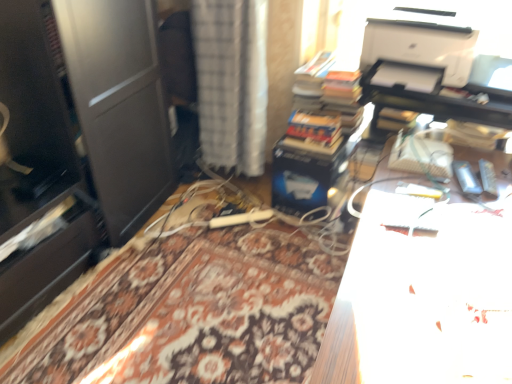
Question: From the image's perspective, is white matte printer at upper right under hardcover books at center?

Choices:
 (A) no
 (B) yes

Answer: (A)

Question: Is white matte printer at upper right to the right of hardcover books at center from the viewer's perspective?

Choices:
 (A) yes
 (B) no

Answer: (A)

Question: Can we say white matte printer at upper right lies outside hardcover books at center?

Choices:
 (A) yes
 (B) no

Answer: (A)

Question: Does white matte printer at upper right have a greater width compared to hardcover books at center?

Choices:
 (A) yes
 (B) no

Answer: (B)

Question: Is white matte printer at upper right behind hardcover books at center?

Choices:
 (A) yes
 (B) no

Answer: (B)

Question: From a real-world perspective, relative to white textured curtain at center, is white matte printer at upper right vertically above or below?

Choices:
 (A) below
 (B) above

Answer: (B)

Question: Is point (369, 43) positioned closer to the camera than point (266, 97)?

Choices:
 (A) farther
 (B) closer

Answer: (B)

Question: Would you say white matte printer at upper right is inside or outside white textured curtain at center?

Choices:
 (A) inside
 (B) outside

Answer: (B)

Question: Looking at their shapes, would you say white matte printer at upper right is wider or thinner than white textured curtain at center?

Choices:
 (A) wide
 (B) thin

Answer: (A)

Question: Considering their positions, is hardcover books at center located in front of or behind white textured curtain at center?

Choices:
 (A) behind
 (B) front

Answer: (A)

Question: From a real-world perspective, is hardcover books at center physically located above or below white textured curtain at center?

Choices:
 (A) below
 (B) above

Answer: (B)

Question: Based on their sizes in the image, would you say hardcover books at center is bigger or smaller than white textured curtain at center?

Choices:
 (A) small
 (B) big

Answer: (A)

Question: Considering the positions of hardcover books at center and white textured curtain at center in the image, is hardcover books at center wider or thinner than white textured curtain at center?

Choices:
 (A) thin
 (B) wide

Answer: (B)

Question: From their relative heights in the image, would you say white glossy paper at upper right is taller or shorter than white textured curtain at center?

Choices:
 (A) short
 (B) tall

Answer: (A)

Question: Is white glossy paper at upper right in front of or behind white textured curtain at center in the image?

Choices:
 (A) front
 (B) behind

Answer: (A)